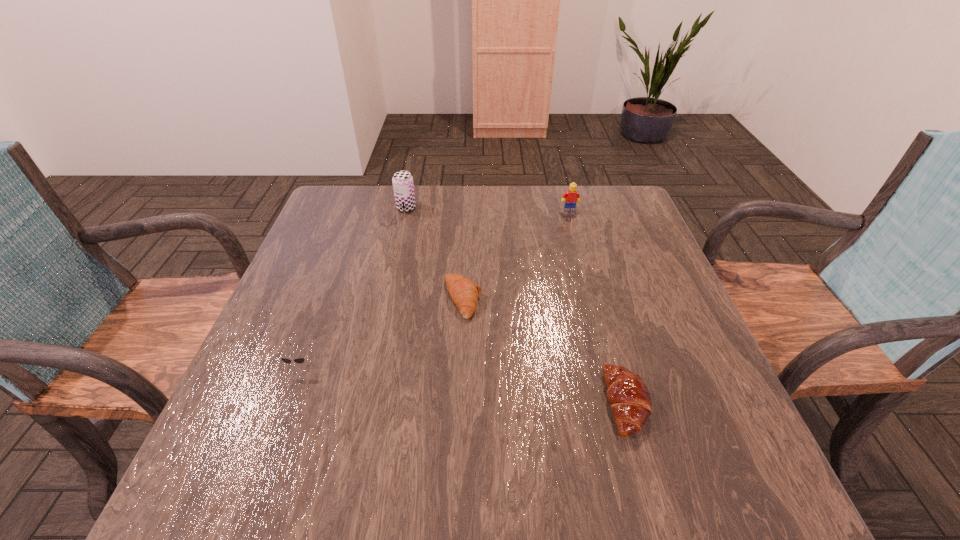
You are a GUI agent. You are given a task and a screenshot of the screen. Output one action in this format:
    pyautogui.click(x=<x>, y=<y>)
    Task: Click on the vacant space at the near left corner
    
    Given the screenshot: What is the action you would take?
    pyautogui.click(x=244, y=501)

The image size is (960, 540). I want to click on vacant space at the far right corner, so click(x=613, y=196).

Locate an element on the screen. This screenshot has width=960, height=540. free space between the beer can and the leftmost object is located at coordinates click(x=354, y=286).

At what (x,y) coordinates should I click in order to perform the action: click on vacant area between the fourth shortest object and the leftmost object. Please return your answer as a coordinate pair (x, y). Looking at the image, I should click on (436, 287).

This screenshot has width=960, height=540. Find the location of `vacant area that lies between the farther crescent roll and the sunglasses`. vacant area that lies between the farther crescent roll and the sunglasses is located at coordinates (382, 331).

Locate an element on the screen. unoccupied area between the Lego and the beer can is located at coordinates (488, 209).

Locate an element on the screen. unoccupied position between the right crescent roll and the third farthest object is located at coordinates (544, 351).

Where is `free space that is in between the right crescent roll and the farther crescent roll`? free space that is in between the right crescent roll and the farther crescent roll is located at coordinates (544, 351).

Where is `free area in between the right crescent roll and the second object from left to right`? The height and width of the screenshot is (540, 960). free area in between the right crescent roll and the second object from left to right is located at coordinates (516, 306).

This screenshot has height=540, width=960. In order to click on free space between the right crescent roll and the fourth object from right to left in this screenshot , I will do `click(516, 306)`.